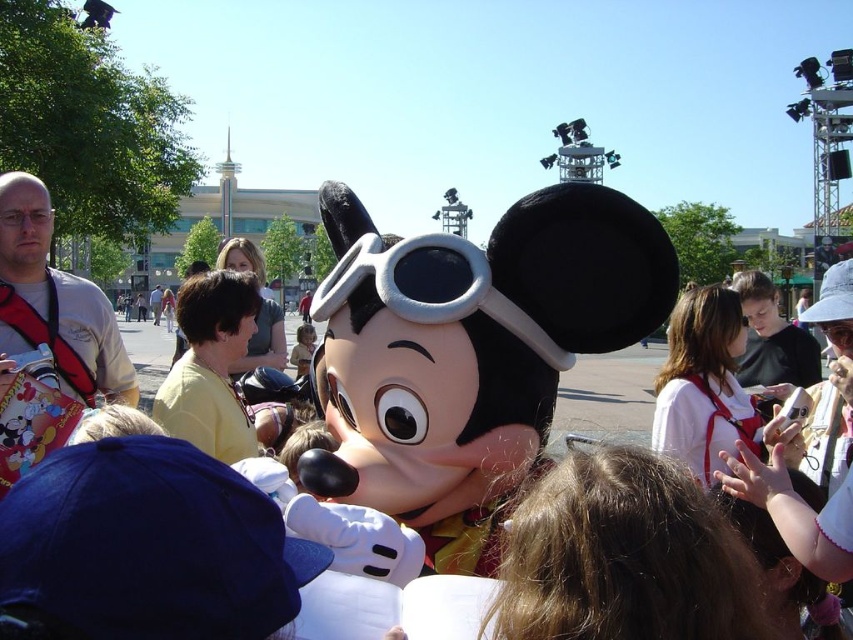
Question: Does matte black plush at center appear on the right side of soft gray fabric goggles at center?

Choices:
 (A) yes
 (B) no

Answer: (A)

Question: Does matte black plush at center have a smaller size compared to soft gray fabric goggles at center?

Choices:
 (A) no
 (B) yes

Answer: (A)

Question: Does matte black plush at center appear on the left side of soft gray fabric goggles at center?

Choices:
 (A) no
 (B) yes

Answer: (A)

Question: Which point is farther from the camera taking this photo?

Choices:
 (A) (532, 314)
 (B) (529, 339)

Answer: (A)